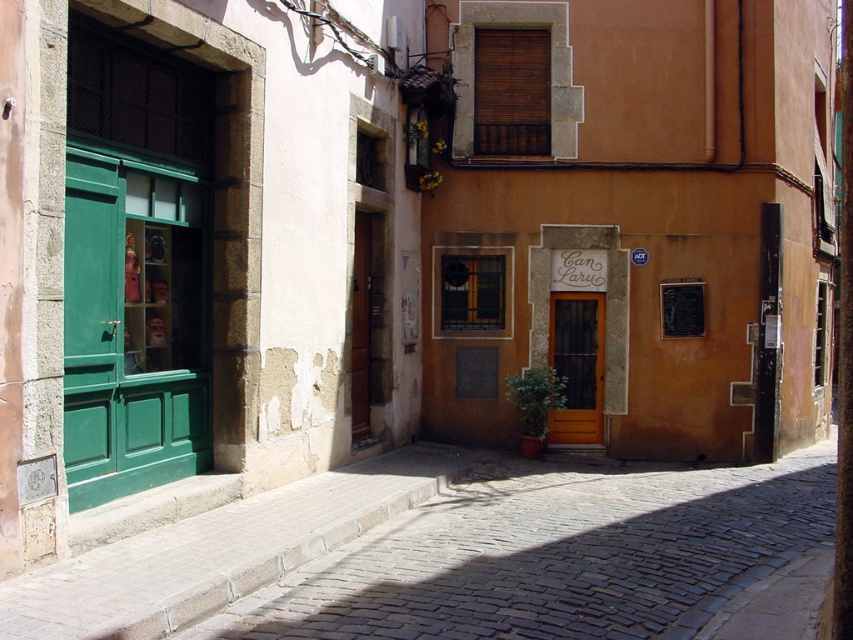
Who is lower down, cobblestone pavement at lower center or brown wooden door at center?

cobblestone pavement at lower center

Does cobblestone pavement at lower center appear over brown wooden door at center?

Incorrect, cobblestone pavement at lower center is not positioned above brown wooden door at center.

Find the location of a particular element. cobblestone pavement at lower center is located at coordinates (554, 556).

Between green wood door at left and brown wooden door at center, which one has more height?

Standing taller between the two is green wood door at left.

Is green wood door at left smaller than brown wooden door at center?

No, green wood door at left is not smaller than brown wooden door at center.

Locate an element on the screen. This screenshot has width=853, height=640. green wood door at left is located at coordinates pyautogui.click(x=134, y=323).

Is cobblestone pavement at lower center above green wood door at left?

Actually, cobblestone pavement at lower center is below green wood door at left.

Which is in front, point (677, 564) or point (184, 400)?

Point (677, 564) is in front.

Find the location of a particular element. The height and width of the screenshot is (640, 853). cobblestone pavement at lower center is located at coordinates (554, 556).